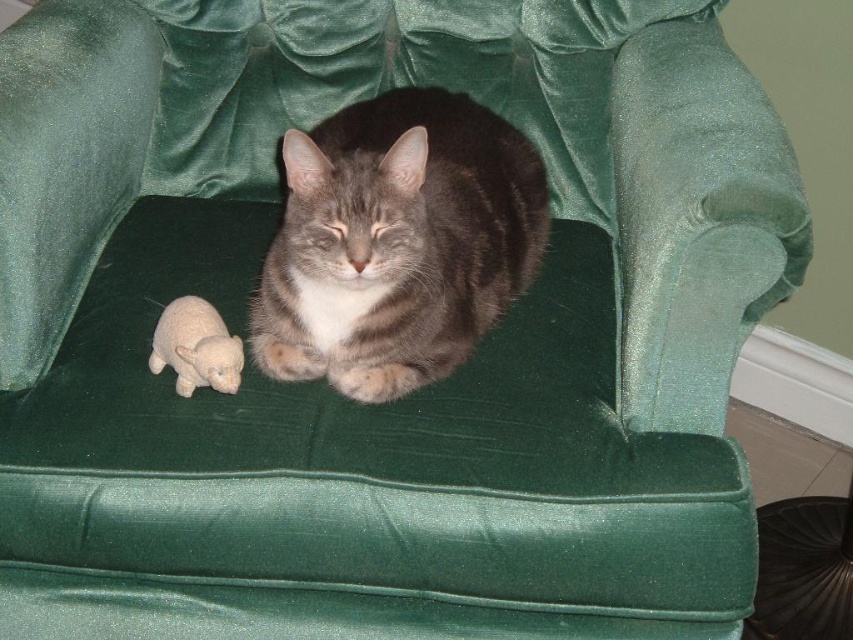
The width and height of the screenshot is (853, 640). What do you see at coordinates (397, 243) in the screenshot? I see `gray striped fur cat at center` at bounding box center [397, 243].

Which is in front, point (500, 237) or point (155, 368)?

Point (155, 368)

Where is `gray striped fur cat at center`? gray striped fur cat at center is located at coordinates (397, 243).